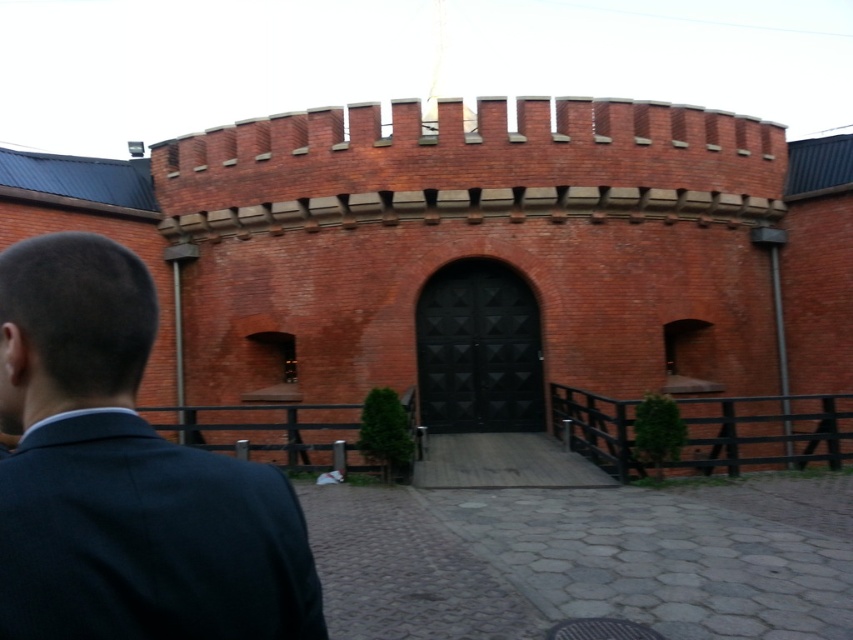
Question: Which of the following is the closest to the observer?

Choices:
 (A) (262, 500)
 (B) (376, 186)

Answer: (A)

Question: Is red brick castle at center smaller than dark blue suit at left?

Choices:
 (A) yes
 (B) no

Answer: (B)

Question: Is red brick castle at center below dark blue suit at left?

Choices:
 (A) yes
 (B) no

Answer: (B)

Question: Can you confirm if red brick castle at center is positioned above dark blue suit at left?

Choices:
 (A) no
 (B) yes

Answer: (B)

Question: Which of the following is the farthest from the observer?

Choices:
 (A) (350, 332)
 (B) (206, 588)

Answer: (A)

Question: Which object is farther from the camera taking this photo?

Choices:
 (A) red brick castle at center
 (B) dark blue suit at left

Answer: (A)